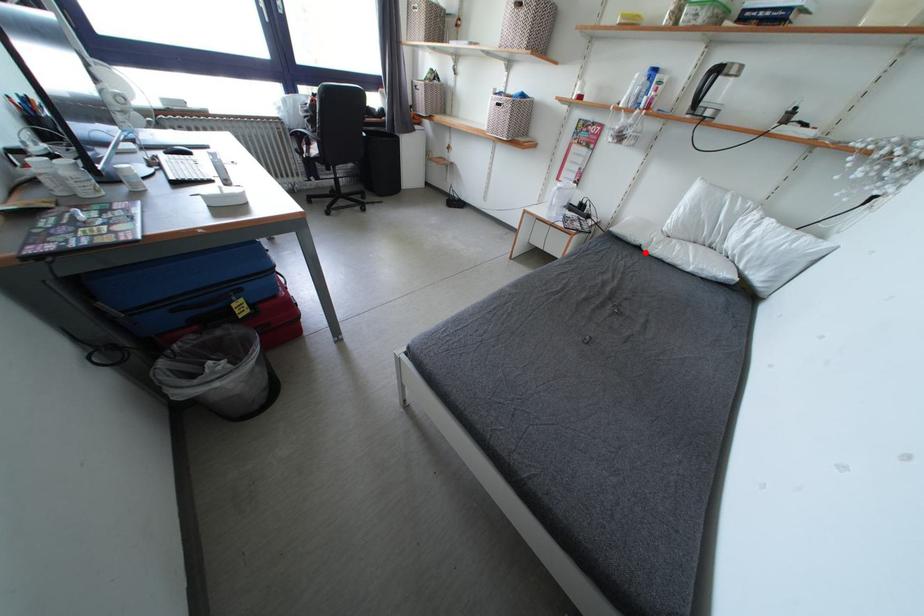
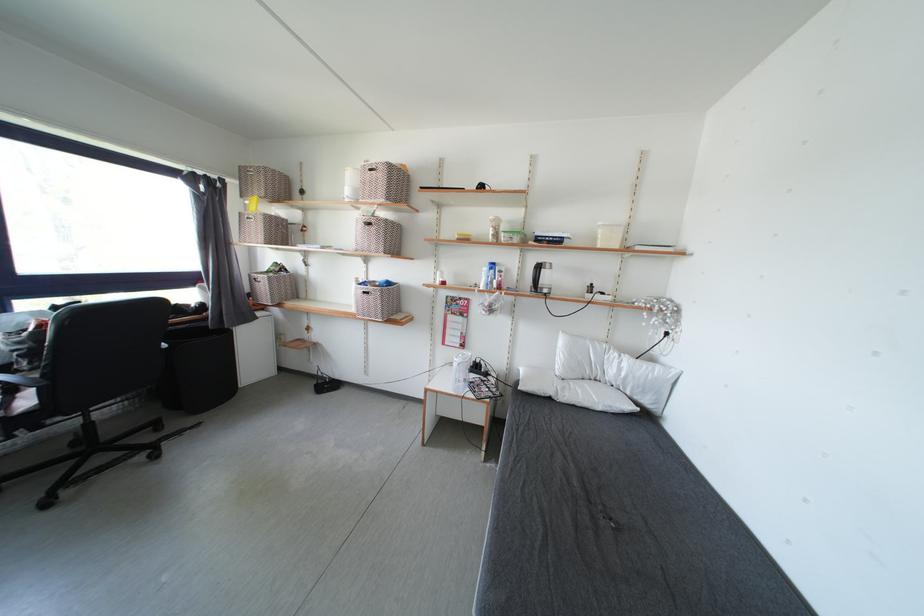
Locate, in the second image, the point that corresponds to the highlighted location in the first image.

(556, 403)